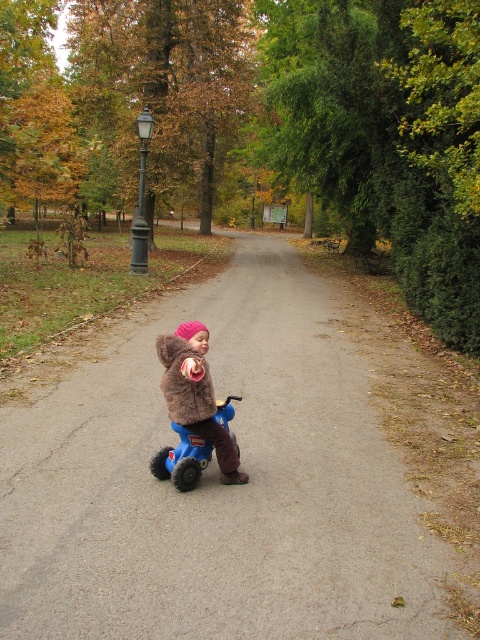
Question: Is matte blue tricycle at center to the right of green painted metal lamp post at upper left from the viewer's perspective?

Choices:
 (A) no
 (B) yes

Answer: (A)

Question: Can you confirm if matte blue tricycle at center is thinner than green painted metal lamp post at upper left?

Choices:
 (A) yes
 (B) no

Answer: (B)

Question: Which of the following is the farthest from the observer?

Choices:
 (A) blue rubber toy car at center
 (B) fuzzy brown jacket at center
 (C) gray asphalt path at center
 (D) green painted metal lamp post at upper left

Answer: (D)

Question: Among these points, which one is nearest to the camera?

Choices:
 (A) (187, 321)
 (B) (197, 138)
 (C) (362, 417)

Answer: (C)

Question: Can you confirm if gray asphalt path at center is positioned above fuzzy brown jacket at center?

Choices:
 (A) yes
 (B) no

Answer: (A)

Question: Which point is closer to the camera?

Choices:
 (A) (140, 172)
 (B) (364, 202)
 (C) (225, 406)
 (D) (217, 579)

Answer: (D)